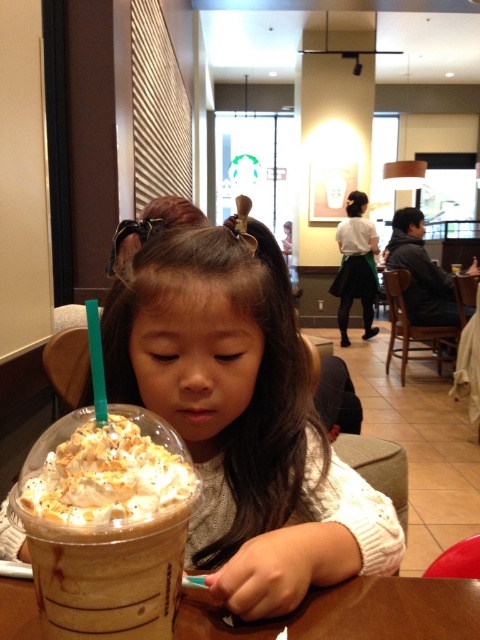
Who is positioned more to the right, whipped cream topped iced coffee at lower left or brown paper cup at center?

brown paper cup at center

Between whipped cream topped iced coffee at lower left and brown paper cup at center, which one appears on the left side from the viewer's perspective?

From the viewer's perspective, whipped cream topped iced coffee at lower left appears more on the left side.

Does point (168, 621) come in front of point (3, 618)?

Yes.

I want to click on whipped cream topped iced coffee at lower left, so [x=107, y=524].

Who is lower down, matte brown cupcake at center or whipped cream topped iced coffee at lower left?

whipped cream topped iced coffee at lower left is lower down.

Can you confirm if matte brown cupcake at center is thinner than whipped cream topped iced coffee at lower left?

No.

Measure the distance between point [156,307] and camera.

Point [156,307] and camera are 22.07 inches apart.

Identify the location of matte brown cupcake at center. (242, 419).

Is matte brown cupcake at center bigger than brown paper cup at center?

Indeed, matte brown cupcake at center has a larger size compared to brown paper cup at center.

Can you confirm if matte brown cupcake at center is positioned below brown paper cup at center?

Answer: Actually, matte brown cupcake at center is above brown paper cup at center.

Does point (204, 508) come behind point (424, 588)?

That is True.

Identify the location of matte brown cupcake at center. This screenshot has width=480, height=640. (242, 419).